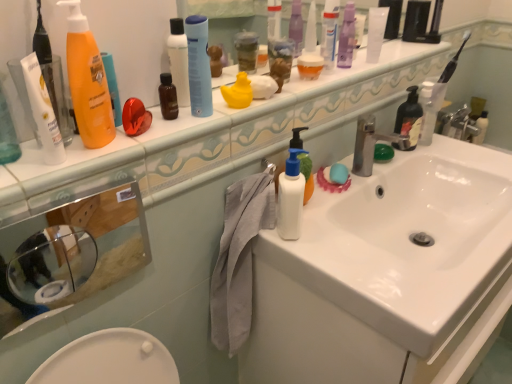
Identify the location of free location to the right of translucent plastic bottle at upper right, placed as the third cleaning product when sorted from front to back. (464, 150).